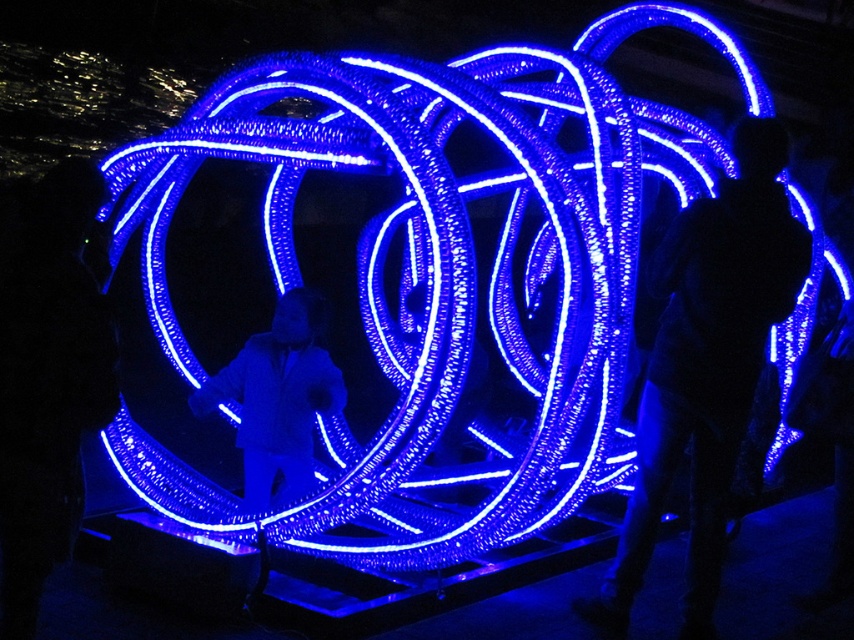
Question: Can you confirm if silhouette figure at right is positioned below matte black suit at center?

Choices:
 (A) no
 (B) yes

Answer: (B)

Question: Which object appears farthest from the camera in this image?

Choices:
 (A) matte black suit at center
 (B) silhouette figure at right

Answer: (A)

Question: Is silhouette figure at right in front of matte black suit at center?

Choices:
 (A) no
 (B) yes

Answer: (B)

Question: Is silhouette figure at right below matte black suit at center?

Choices:
 (A) no
 (B) yes

Answer: (B)

Question: Among these objects, which one is nearest to the camera?

Choices:
 (A) silhouette figure at right
 (B) matte black suit at center

Answer: (A)